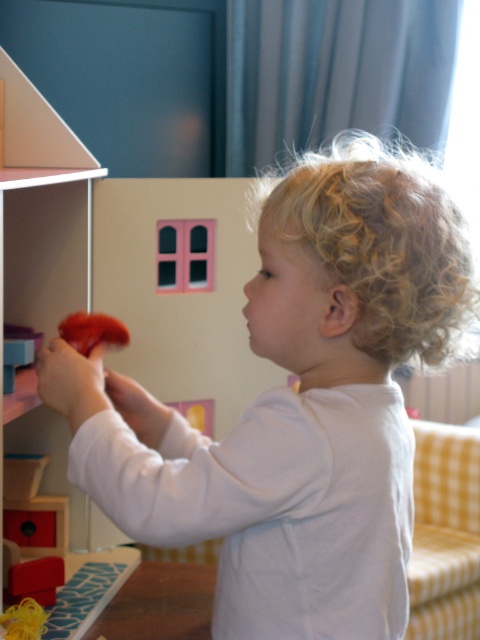
Question: Does curly blonde hair at center appear on the left side of matte red toy at left?

Choices:
 (A) yes
 (B) no

Answer: (B)

Question: Which point appears farthest from the camera in this image?

Choices:
 (A) (78, 324)
 (B) (396, 474)

Answer: (A)

Question: Among these objects, which one is nearest to the camera?

Choices:
 (A) curly blonde hair at center
 (B) matte red toy at left

Answer: (A)

Question: Can you confirm if curly blonde hair at center is bigger than matte red toy at left?

Choices:
 (A) no
 (B) yes

Answer: (B)

Question: Among these points, which one is farthest from the camera?

Choices:
 (A) (121, 344)
 (B) (339, 180)

Answer: (A)

Question: From the image, what is the correct spatial relationship of curly blonde hair at center in relation to matte red toy at left?

Choices:
 (A) above
 (B) below

Answer: (B)